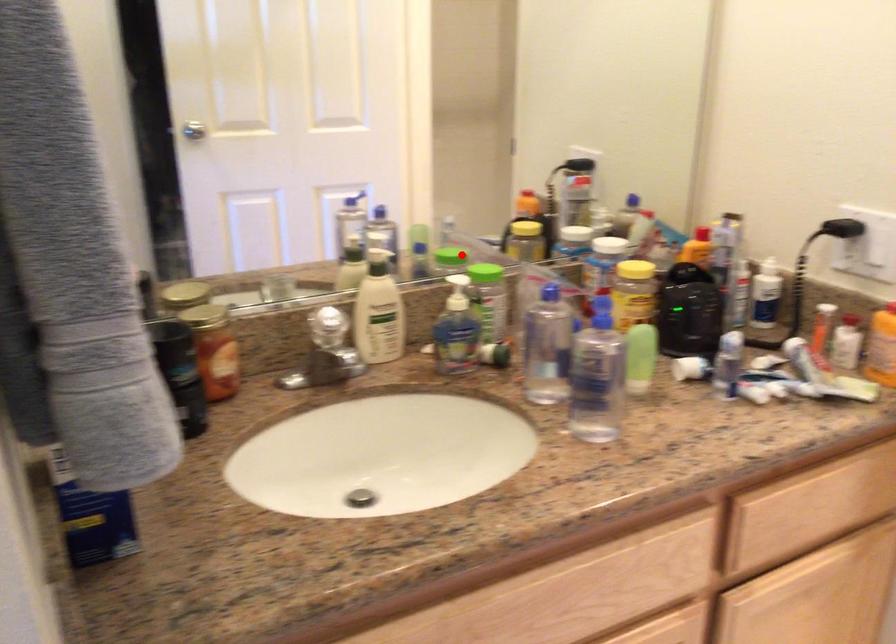
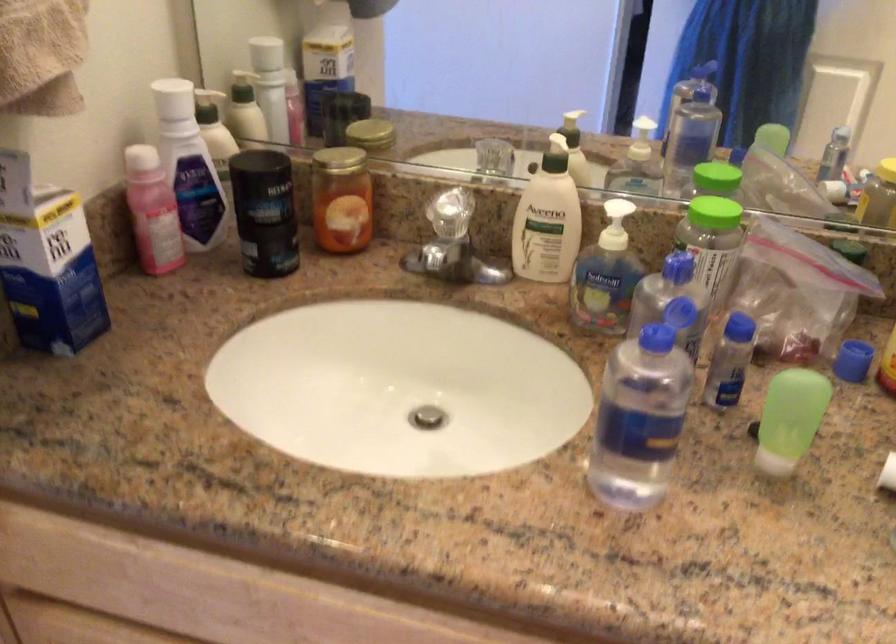
Locate, in the second image, the point that corresponds to the highlighted location in the first image.

(716, 178)